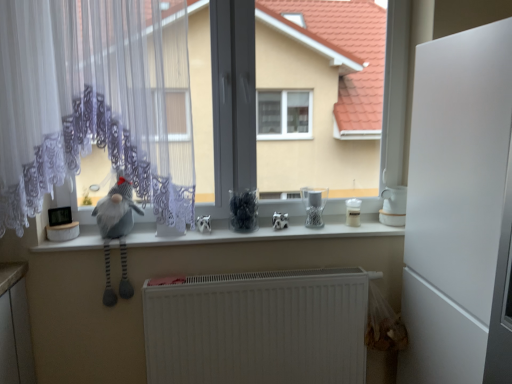
You are a GUI agent. You are given a task and a screenshot of the screen. Output one action in this format:
    pyautogui.click(x=<x>, y=<y>)
    Task: Click on the vacant area that lies in front of white plastic container at center, which is the 2th appliance from right to left
    
    Given the screenshot: What is the action you would take?
    pyautogui.click(x=355, y=229)